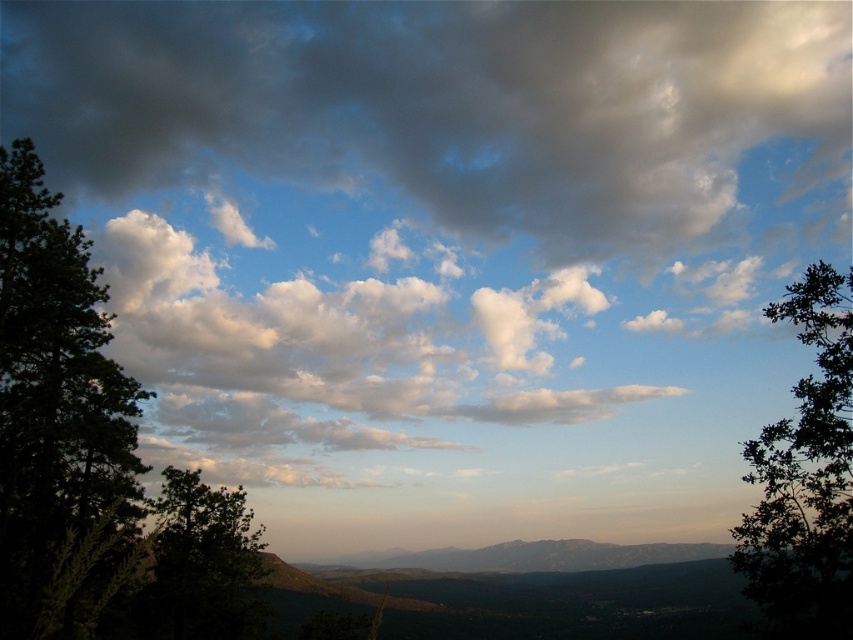
Question: Which of these objects is positioned farthest from the green leafy tree at right?

Choices:
 (A) green matte tree at left
 (B) cloudy sky at upper center

Answer: (B)

Question: Is dark green leafy tree at left to the right of green matte tree at left from the viewer's perspective?

Choices:
 (A) no
 (B) yes

Answer: (B)

Question: Which point is farther from the camera taking this photo?

Choices:
 (A) click(x=775, y=532)
 (B) click(x=187, y=620)
 (C) click(x=833, y=120)
 (D) click(x=45, y=214)

Answer: (C)

Question: Which point appears farthest from the camera in this image?

Choices:
 (A) (784, 77)
 (B) (791, 554)

Answer: (A)

Question: Can you confirm if cloudy sky at upper center is positioned to the right of green matte tree at left?

Choices:
 (A) yes
 (B) no

Answer: (A)

Question: Does cloudy sky at upper center come in front of dark green leafy tree at left?

Choices:
 (A) yes
 (B) no

Answer: (B)